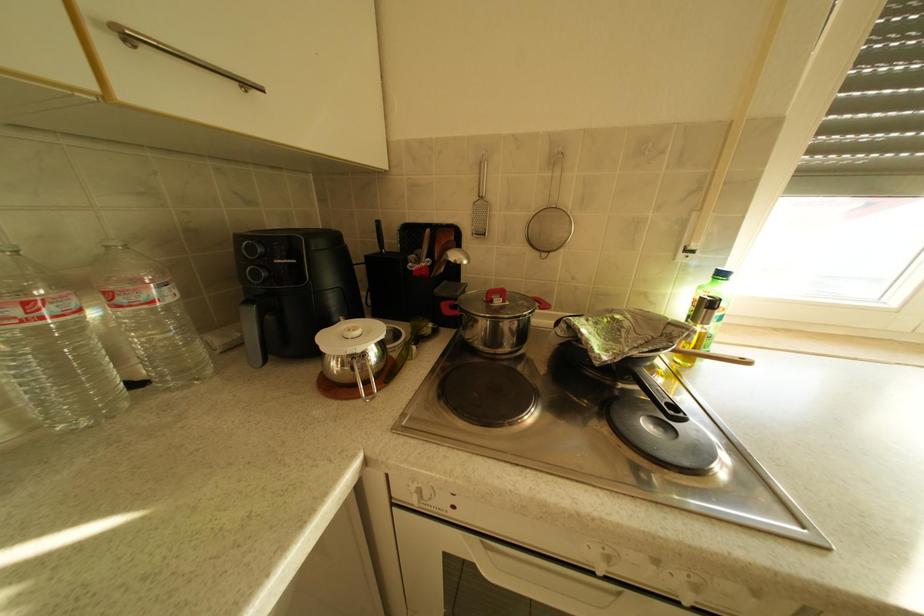
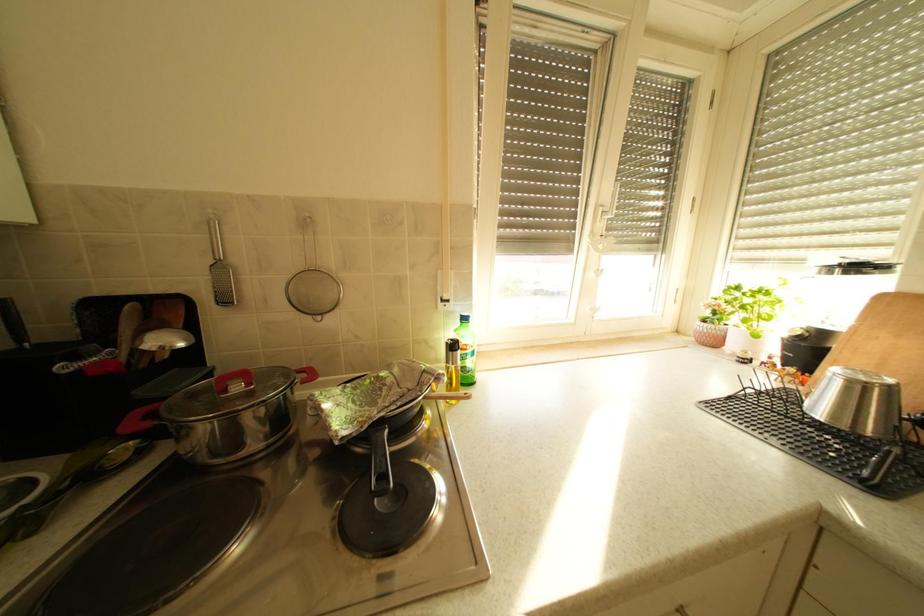
Question: The camera is either moving clockwise (left) or counter-clockwise (right) around the object. The first image is from the beginning of the video and the second image is from the end. Is the camera moving left or right when shooting the video?

Choices:
 (A) Left
 (B) Right

Answer: (A)